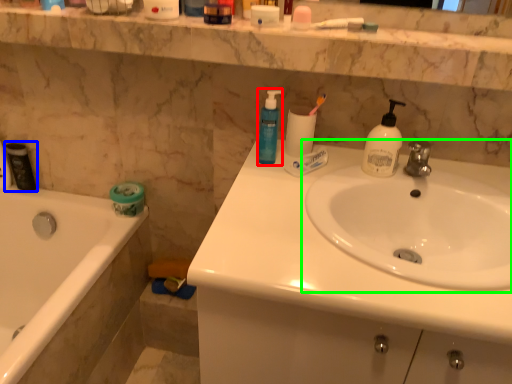
Question: Considering the real-world distances, which object is closest to soap dispenser (highlighted by a red box)? mouthwash (highlighted by a blue box) or sink (highlighted by a green box).

Choices:
 (A) mouthwash
 (B) sink

Answer: (B)